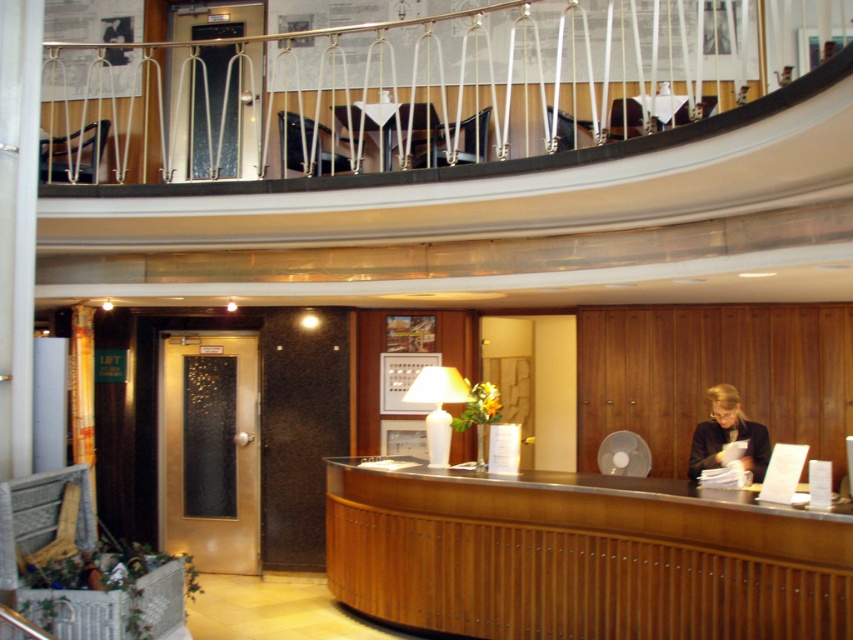
Question: Does wooden reception desk at center appear on the left side of black fabric jacket at center?

Choices:
 (A) no
 (B) yes

Answer: (B)

Question: Does wooden reception desk at center have a larger size compared to black fabric jacket at center?

Choices:
 (A) no
 (B) yes

Answer: (B)

Question: Among these points, which one is nearest to the camera?

Choices:
 (A) (732, 595)
 (B) (722, 436)

Answer: (A)

Question: Is wooden reception desk at center positioned behind black fabric jacket at center?

Choices:
 (A) no
 (B) yes

Answer: (A)

Question: Which point appears farthest from the camera in this image?

Choices:
 (A) (569, 563)
 (B) (752, 460)

Answer: (B)

Question: Among these objects, which one is nearest to the camera?

Choices:
 (A) black fabric jacket at center
 (B) wooden reception desk at center

Answer: (B)